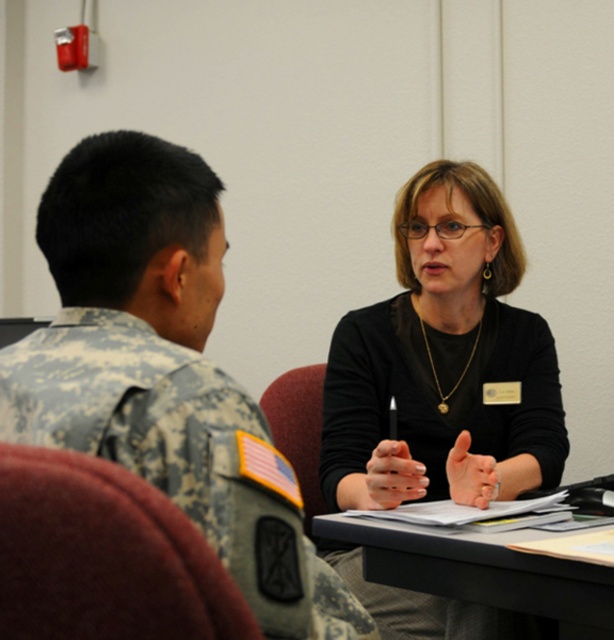
You are an interior designer assessing the layout of an office. You notice the camouflage uniform at left and the black matte shirt at center. Which object takes up more visual space in the scene?

The black matte shirt at center occupies more visual space than the camouflage uniform at left according to the description.